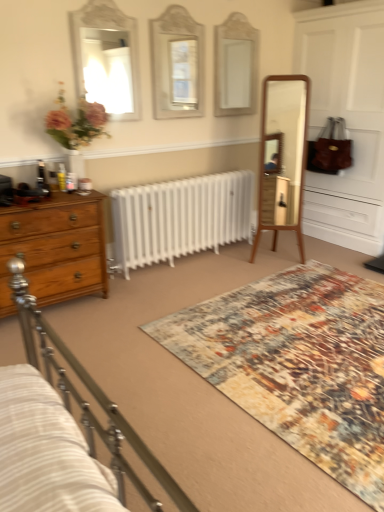
Question: From a real-world perspective, is white glossy mirror at upper left, the first mirror viewed from the left, over matte white mirror at center, acting as the 2th mirror starting from the right?

Choices:
 (A) yes
 (B) no

Answer: (A)

Question: Does white glossy mirror at upper left, the first mirror viewed from the left, have a greater width compared to matte white mirror at center, the second mirror in the left-to-right sequence?

Choices:
 (A) no
 (B) yes

Answer: (A)

Question: Does white glossy mirror at upper left, acting as the third mirror starting from the right, have a larger size compared to matte white mirror at center, acting as the 2th mirror starting from the right?

Choices:
 (A) no
 (B) yes

Answer: (A)

Question: Is white glossy mirror at upper left, acting as the third mirror starting from the right, turned away from matte white mirror at center, the second mirror in the left-to-right sequence?

Choices:
 (A) yes
 (B) no

Answer: (B)

Question: Can you confirm if white glossy mirror at upper left, acting as the third mirror starting from the right, is shorter than matte white mirror at center, the second mirror in the left-to-right sequence?

Choices:
 (A) no
 (B) yes

Answer: (B)

Question: Is multicolored textured rug at center inside the boundaries of white glossy mirror at upper left, the first mirror viewed from the left, or outside?

Choices:
 (A) inside
 (B) outside

Answer: (B)

Question: Is multicolored textured rug at center to the left or to the right of white glossy mirror at upper left, acting as the third mirror starting from the right, in the image?

Choices:
 (A) right
 (B) left

Answer: (A)

Question: In terms of size, does multicolored textured rug at center appear bigger or smaller than white glossy mirror at upper left, the first mirror viewed from the left?

Choices:
 (A) big
 (B) small

Answer: (A)

Question: From their relative heights in the image, would you say multicolored textured rug at center is taller or shorter than white glossy mirror at upper left, acting as the third mirror starting from the right?

Choices:
 (A) tall
 (B) short

Answer: (B)

Question: From the image's perspective, relative to white glass mirror at upper center, arranged as the third mirror when viewed from the left, is white glossy mirror at upper left, the first mirror viewed from the left, above or below?

Choices:
 (A) above
 (B) below

Answer: (B)

Question: Is white glossy mirror at upper left, the first mirror viewed from the left, inside the boundaries of white glass mirror at upper center, which is the first mirror from right to left, or outside?

Choices:
 (A) outside
 (B) inside

Answer: (A)

Question: Is point (135, 50) closer or farther from the camera than point (215, 28)?

Choices:
 (A) closer
 (B) farther

Answer: (A)

Question: From a real-world perspective, is white glossy mirror at upper left, the first mirror viewed from the left, positioned above or below white glass mirror at upper center, arranged as the third mirror when viewed from the left?

Choices:
 (A) above
 (B) below

Answer: (A)

Question: Is point (380, 352) closer or farther from the camera than point (178, 31)?

Choices:
 (A) farther
 (B) closer

Answer: (B)

Question: In the image, is multicolored textured rug at center on the left side or the right side of matte white mirror at center, acting as the 2th mirror starting from the right?

Choices:
 (A) left
 (B) right

Answer: (B)